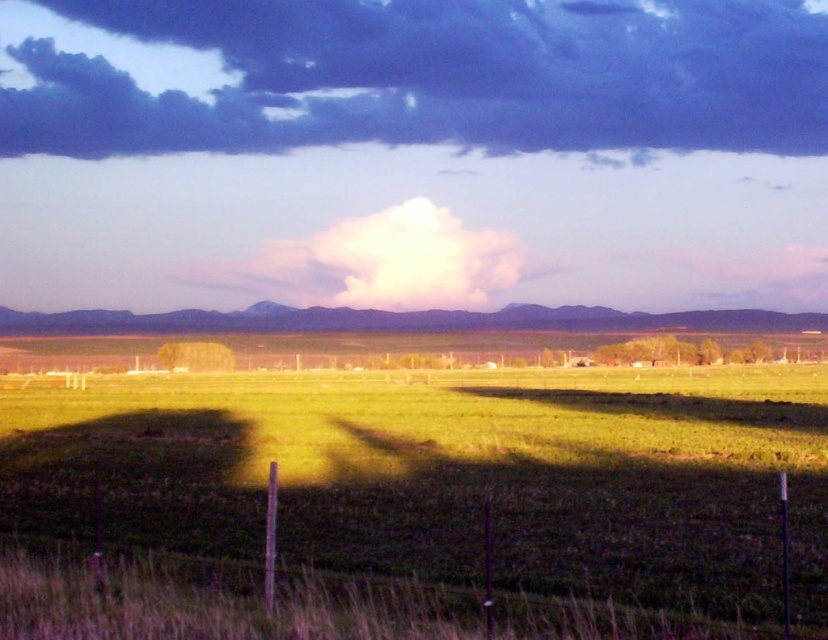
Question: Is green grassy field at center to the right of dark blue cloud at upper center from the viewer's perspective?

Choices:
 (A) no
 (B) yes

Answer: (B)

Question: Can you confirm if green grassy field at center is positioned below dark blue cloud at upper center?

Choices:
 (A) no
 (B) yes

Answer: (B)

Question: Among these objects, which one is farthest from the camera?

Choices:
 (A) green grassy field at center
 (B) dark blue cloud at upper center

Answer: (B)

Question: Which of the following is the farthest from the observer?

Choices:
 (A) (725, 486)
 (B) (239, 104)

Answer: (B)

Question: Is green grassy field at center to the right of dark blue cloud at upper center from the viewer's perspective?

Choices:
 (A) no
 (B) yes

Answer: (B)